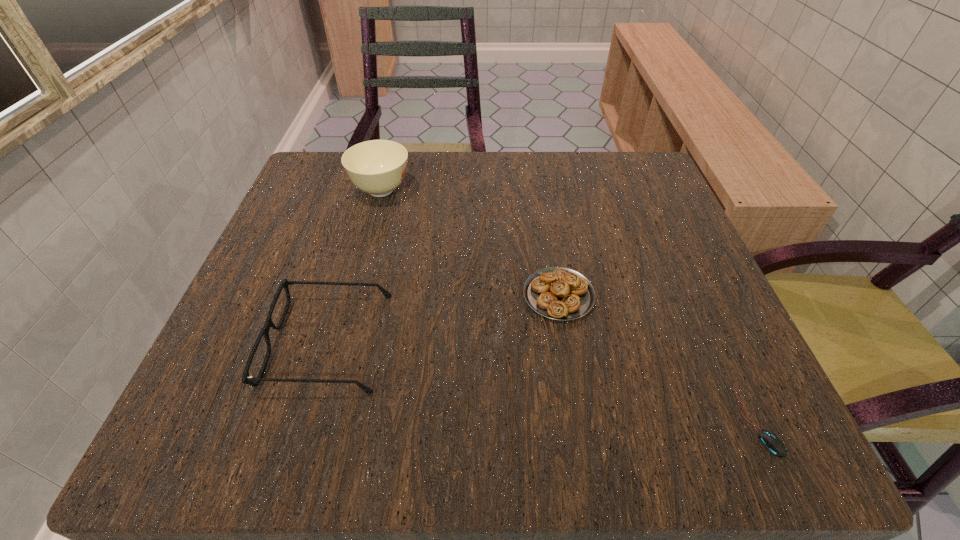
At what (x,y) coordinates should I click in order to perform the action: click on sugar bowl. Please return your answer as a coordinate pair (x, y). Looking at the image, I should click on (377, 167).

I want to click on the farthest object, so click(x=377, y=167).

This screenshot has width=960, height=540. Identify the location of the second tallest object. (246, 379).

Where is `the second shortest object`? the second shortest object is located at coordinates (558, 293).

Where is `the second object from right to left`? the second object from right to left is located at coordinates (558, 293).

This screenshot has width=960, height=540. What are the coordinates of `the nearest object` in the screenshot? It's located at (771, 442).

In order to click on mouse in this screenshot , I will do (x=771, y=442).

The width and height of the screenshot is (960, 540). I want to click on vacant space located on the right of the tallest object, so click(x=574, y=190).

Identify the location of vacant space located 0.080m on the front-facing side of the spectacles. This screenshot has width=960, height=540. (219, 341).

I want to click on free spot located on the front-facing side of the spectacles, so click(x=239, y=341).